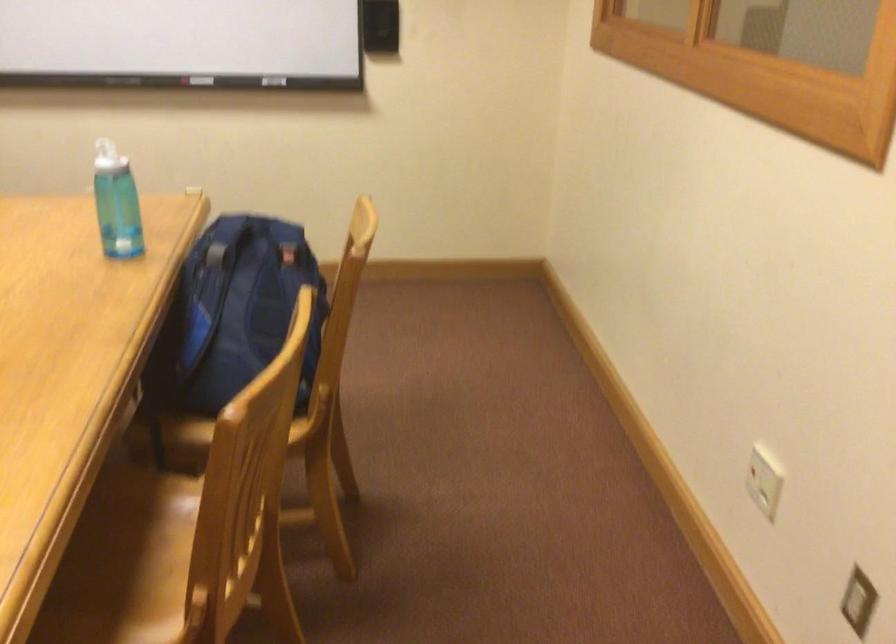
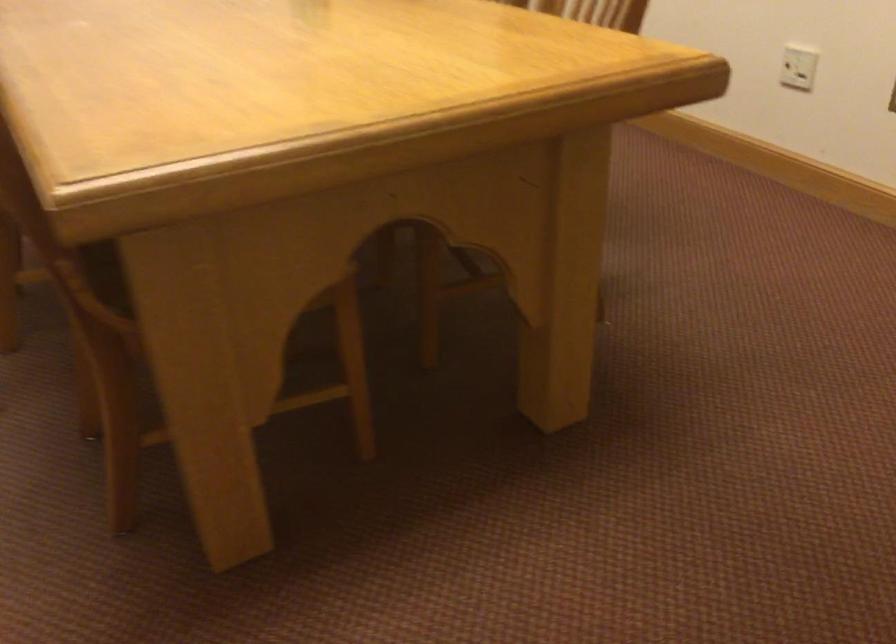
Question: The images are taken continuously from a first-person perspective. In which direction are you moving?

Choices:
 (A) Left
 (B) Right
 (C) Forward
 (D) Backward

Answer: (A)